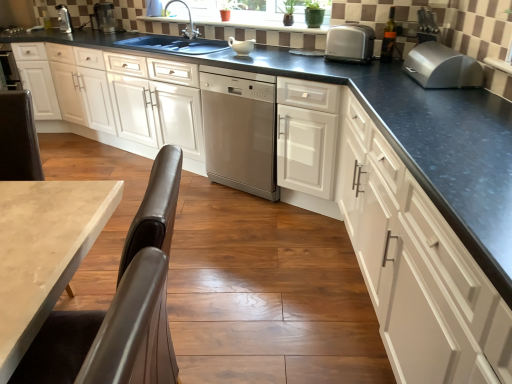
This screenshot has width=512, height=384. I want to click on green matte plant at upper center, so click(237, 18).

Locate an element on the screen. The image size is (512, 384). satin silver toaster at upper right, the first kitchen appliance from the back is located at coordinates (350, 43).

Identify the location of metallic silver blender at upper left, placed as the 2th appliance when sorted from left to right. The image size is (512, 384). (106, 17).

Where is `white glossy cabinet at center, which is counted as the 3th cabinetry, starting from the right`? This screenshot has height=384, width=512. white glossy cabinet at center, which is counted as the 3th cabinetry, starting from the right is located at coordinates (113, 97).

This screenshot has width=512, height=384. I want to click on silver metallic faucet at upper center, so click(x=189, y=21).

Find the location of `green matte plant at upper center`. green matte plant at upper center is located at coordinates (237, 18).

Which object is positioned more to the left, white glossy cabinet at center, acting as the second cabinetry starting from the right, or stainless steel dishwasher at center?

stainless steel dishwasher at center.

Is white glossy cabinet at center, arranged as the 2th cabinetry when viewed from the left, shorter than stainless steel dishwasher at center?

Yes, white glossy cabinet at center, arranged as the 2th cabinetry when viewed from the left, is shorter than stainless steel dishwasher at center.

Looking at this image, considering the relative sizes of white glossy cabinet at center, acting as the second cabinetry starting from the right, and stainless steel dishwasher at center in the image provided, is white glossy cabinet at center, acting as the second cabinetry starting from the right, wider than stainless steel dishwasher at center?

No.

Considering the sizes of brown leather chair at lower left and white glossy cabinet at center, acting as the second cabinetry starting from the right, in the image, is brown leather chair at lower left taller or shorter than white glossy cabinet at center, acting as the second cabinetry starting from the right,?

In the image, brown leather chair at lower left appears to be shorter than white glossy cabinet at center, acting as the second cabinetry starting from the right.

Is brown leather chair at lower left bigger or smaller than white glossy cabinet at center, acting as the second cabinetry starting from the right?

brown leather chair at lower left is smaller than white glossy cabinet at center, acting as the second cabinetry starting from the right.

Does brown leather chair at lower left come behind white glossy cabinet at center, acting as the second cabinetry starting from the right?

No.

Is brown leather chair at lower left at the left side of white glossy cabinet at center, acting as the second cabinetry starting from the right?

Yes.

Can you confirm if satin silver toaster at upper right, which is the first kitchen appliance from left to right, is bigger than white glossy cabinet at center, arranged as the 2th cabinetry when viewed from the left?

No, satin silver toaster at upper right, which is the first kitchen appliance from left to right, is not bigger than white glossy cabinet at center, arranged as the 2th cabinetry when viewed from the left.

Which of these two, satin silver toaster at upper right, which is counted as the second kitchen appliance, starting from the right, or white glossy cabinet at center, arranged as the 2th cabinetry when viewed from the left, stands shorter?

With less height is satin silver toaster at upper right, which is counted as the second kitchen appliance, starting from the right.

Which object is positioned more to the right, satin silver toaster at upper right, the first kitchen appliance when ordered from top to bottom, or white glossy cabinet at center, acting as the second cabinetry starting from the right?

satin silver toaster at upper right, the first kitchen appliance when ordered from top to bottom.

Measure the distance between satin silver toaster at upper right, which is counted as the second kitchen appliance, starting from the right, and white glossy cabinet at center, arranged as the 2th cabinetry when viewed from the left.

satin silver toaster at upper right, which is counted as the second kitchen appliance, starting from the right, is 20.32 inches away from white glossy cabinet at center, arranged as the 2th cabinetry when viewed from the left.

Would you say silver metallic breadbox at upper right, which ranks as the first kitchen appliance in right-to-left order, is inside or outside stainless steel dishwasher at center?

silver metallic breadbox at upper right, which ranks as the first kitchen appliance in right-to-left order, lies outside stainless steel dishwasher at center.

Which is more to the left, silver metallic breadbox at upper right, the 2th kitchen appliance positioned from the top, or stainless steel dishwasher at center?

stainless steel dishwasher at center is more to the left.

In terms of height, does silver metallic breadbox at upper right, the 2th kitchen appliance positioned from the top, look taller or shorter compared to stainless steel dishwasher at center?

silver metallic breadbox at upper right, the 2th kitchen appliance positioned from the top, is shorter than stainless steel dishwasher at center.

Does silver metallic breadbox at upper right, placed as the 1th kitchen appliance when sorted from bottom to top, lie in front of stainless steel dishwasher at center?

Yes, the depth of silver metallic breadbox at upper right, placed as the 1th kitchen appliance when sorted from bottom to top, is less than that of stainless steel dishwasher at center.

How far apart are satin silver toaster at upper right, which is counted as the second kitchen appliance, starting from the right, and green matte plant at upper center?

They are 28.72 inches apart.

In the scene shown: Is green matte plant at upper center surrounded by satin silver toaster at upper right, which is the first kitchen appliance from left to right?

No, green matte plant at upper center is not inside satin silver toaster at upper right, which is the first kitchen appliance from left to right.

From the image's perspective, which is below, satin silver toaster at upper right, which is the first kitchen appliance from left to right, or green matte plant at upper center?

From the image's view, satin silver toaster at upper right, which is the first kitchen appliance from left to right, is below.

Does satin silver toaster at upper right, the first kitchen appliance when ordered from top to bottom, lie in front of green matte plant at upper center?

Yes, satin silver toaster at upper right, the first kitchen appliance when ordered from top to bottom, is closer to the viewer.

How many degrees apart are the facing directions of metallic silver blender at upper left, which appears as the 1th appliance when viewed from the right, and white glossy cabinet at center, which is counted as the 3th cabinetry, starting from the right?

1.78 degrees separate the facing orientations of metallic silver blender at upper left, which appears as the 1th appliance when viewed from the right, and white glossy cabinet at center, which is counted as the 3th cabinetry, starting from the right.

Would you consider metallic silver blender at upper left, placed as the 2th appliance when sorted from left to right, to be distant from white glossy cabinet at center, arranged as the 1th cabinetry when viewed from the left?

Actually, metallic silver blender at upper left, placed as the 2th appliance when sorted from left to right, and white glossy cabinet at center, arranged as the 1th cabinetry when viewed from the left, are a little close together.

From a real-world perspective, is metallic silver blender at upper left, which appears as the 1th appliance when viewed from the right, over white glossy cabinet at center, which is counted as the 3th cabinetry, starting from the right?

Indeed, from a real-world perspective, metallic silver blender at upper left, which appears as the 1th appliance when viewed from the right, stands above white glossy cabinet at center, which is counted as the 3th cabinetry, starting from the right.

How far apart are silver metallic faucet at upper center and metallic silver blender at upper left, which appears as the 1th appliance when viewed from the right?

silver metallic faucet at upper center is 29.88 inches from metallic silver blender at upper left, which appears as the 1th appliance when viewed from the right.

From the image's perspective, is silver metallic faucet at upper center positioned above or below metallic silver blender at upper left, placed as the 2th appliance when sorted from left to right?

From the image's perspective, silver metallic faucet at upper center appears below metallic silver blender at upper left, placed as the 2th appliance when sorted from left to right.

Which of these two, silver metallic faucet at upper center or metallic silver blender at upper left, placed as the 2th appliance when sorted from left to right, is smaller?

With smaller size is metallic silver blender at upper left, placed as the 2th appliance when sorted from left to right.

Is there a large distance between silver metallic faucet at upper center and metallic silver blender at upper left, placed as the 2th appliance when sorted from left to right?

silver metallic faucet at upper center is near metallic silver blender at upper left, placed as the 2th appliance when sorted from left to right, not far away.

Find the location of a particular element. The width and height of the screenshot is (512, 384). home appliance behind the white glossy cabinet at center, acting as the second cabinetry starting from the right is located at coordinates (240, 130).

Locate an element on the screen. The width and height of the screenshot is (512, 384). chair in front of the white glossy cabinet at center, acting as the second cabinetry starting from the right is located at coordinates (18, 138).

When comparing their distances from metal toaster at upper left, which appears as the second appliance when viewed from the right, does brown leather chair at lower left or metallic silver blender at upper left, placed as the 2th appliance when sorted from left to right, seem closer?

metallic silver blender at upper left, placed as the 2th appliance when sorted from left to right, is closer to metal toaster at upper left, which appears as the second appliance when viewed from the right.

Looking at the image, which one is located closer to white glossy cabinet at center, which is counted as the 3th cabinetry, starting from the right, white glossy cabinets at right, which ranks as the 3th cabinetry in left-to-right order, or brown leather chair at lower left?

brown leather chair at lower left is closer to white glossy cabinet at center, which is counted as the 3th cabinetry, starting from the right.

From the image, which object appears to be farther from silver metallic breadbox at upper right, which ranks as the first kitchen appliance in right-to-left order, metal toaster at upper left, acting as the first appliance starting from the left, or silver metallic faucet at upper center?

metal toaster at upper left, acting as the first appliance starting from the left, lies further to silver metallic breadbox at upper right, which ranks as the first kitchen appliance in right-to-left order, than the other object.

Which object lies further to the anchor point silver metallic faucet at upper center, stainless steel dishwasher at center or white glossy cabinets at right, which ranks as the 3th cabinetry in left-to-right order?

white glossy cabinets at right, which ranks as the 3th cabinetry in left-to-right order, is positioned further to the anchor silver metallic faucet at upper center.

Estimate the real-world distances between objects in this image. Which object is further from metallic silver blender at upper left, placed as the 2th appliance when sorted from left to right, white glossy cabinets at right, which is counted as the first cabinetry, starting from the right, or satin silver toaster at upper right, which is the first kitchen appliance from left to right?

white glossy cabinets at right, which is counted as the first cabinetry, starting from the right.

From the image, which object appears to be nearer to green matte plant at upper center, silver metallic breadbox at upper right, the first kitchen appliance viewed from the front, or silver metallic faucet at upper center?

silver metallic faucet at upper center.

Estimate the real-world distances between objects in this image. Which object is closer to white glossy cabinet at center, acting as the second cabinetry starting from the right, metal toaster at upper left, which appears as the second appliance when viewed from the right, or silver metallic faucet at upper center?

Among the two, silver metallic faucet at upper center is located nearer to white glossy cabinet at center, acting as the second cabinetry starting from the right.

Considering their positions, is stainless steel dishwasher at center positioned closer to white glossy cabinet at center, arranged as the 1th cabinetry when viewed from the left, than satin silver toaster at upper right, positioned as the 2th kitchen appliance in bottom-to-top order?

Based on the image, stainless steel dishwasher at center appears to be nearer to white glossy cabinet at center, arranged as the 1th cabinetry when viewed from the left.

Where is `tap between metal toaster at upper left, which appears as the second appliance when viewed from the right, and silver metallic breadbox at upper right, marked as the 2th kitchen appliance in a left-to-right arrangement`? The width and height of the screenshot is (512, 384). tap between metal toaster at upper left, which appears as the second appliance when viewed from the right, and silver metallic breadbox at upper right, marked as the 2th kitchen appliance in a left-to-right arrangement is located at coordinates (189, 21).

In order to click on home appliance between white glossy cabinets at right, which ranks as the 3th cabinetry in left-to-right order, and silver metallic faucet at upper center in the front-back direction in this screenshot , I will do `click(240, 130)`.

At what (x,y) coordinates should I click in order to perform the action: click on kitchen appliance situated between metal toaster at upper left, which appears as the second appliance when viewed from the right, and white glossy cabinets at right, which is counted as the first cabinetry, starting from the right, from left to right. Please return your answer as a coordinate pair (x, y). The image size is (512, 384). Looking at the image, I should click on (350, 43).

Image resolution: width=512 pixels, height=384 pixels. I want to click on home appliance positioned between brown leather chair at lower left and metal toaster at upper left, which appears as the second appliance when viewed from the right, from near to far, so click(240, 130).